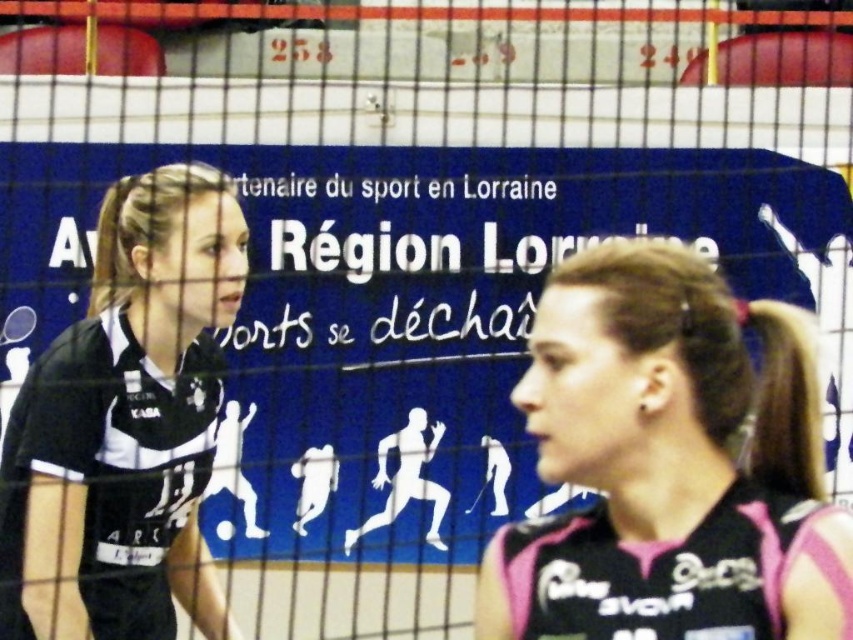
Question: Which point is farther from the camera taking this photo?

Choices:
 (A) (795, 493)
 (B) (151, 272)

Answer: (B)

Question: Which point appears farthest from the camera in this image?

Choices:
 (A) (607, 406)
 (B) (4, 545)

Answer: (B)

Question: Does pink jersey at right come in front of black jersey at left?

Choices:
 (A) no
 (B) yes

Answer: (B)

Question: Is pink jersey at right further to camera compared to black jersey at left?

Choices:
 (A) no
 (B) yes

Answer: (A)

Question: Is pink jersey at right thinner than black jersey at left?

Choices:
 (A) no
 (B) yes

Answer: (A)